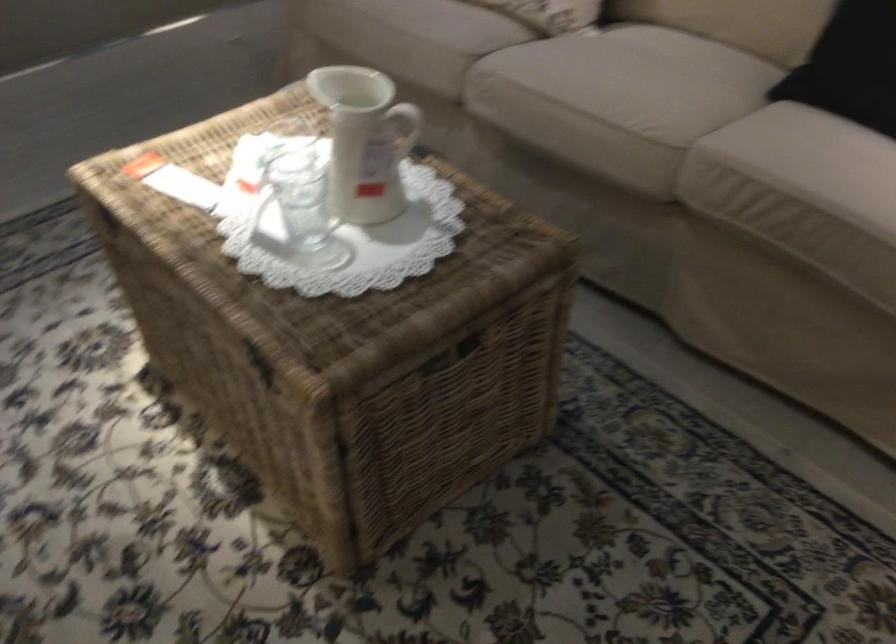
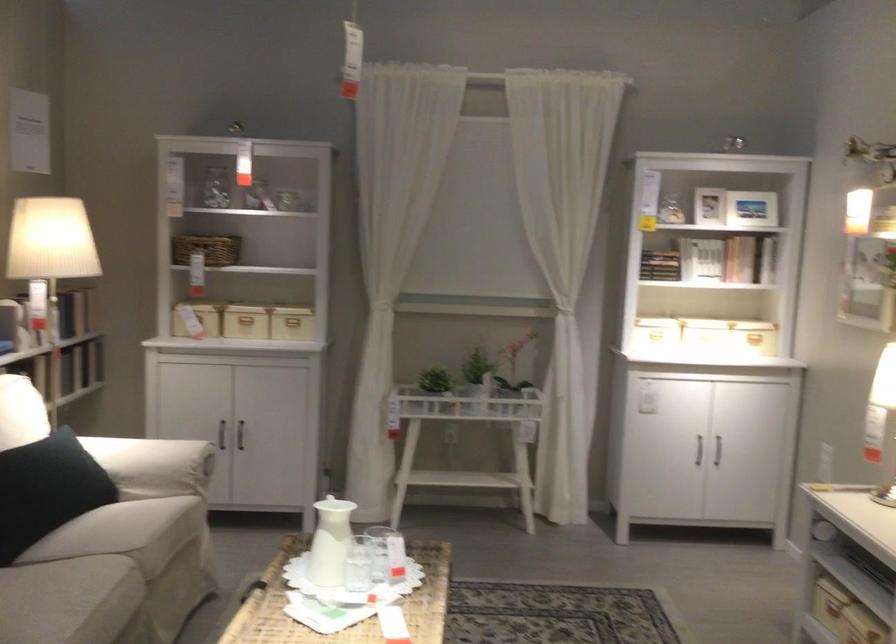
Where in the second image is the point corresponding to the point at 332,192 from the first image?

(358, 564)